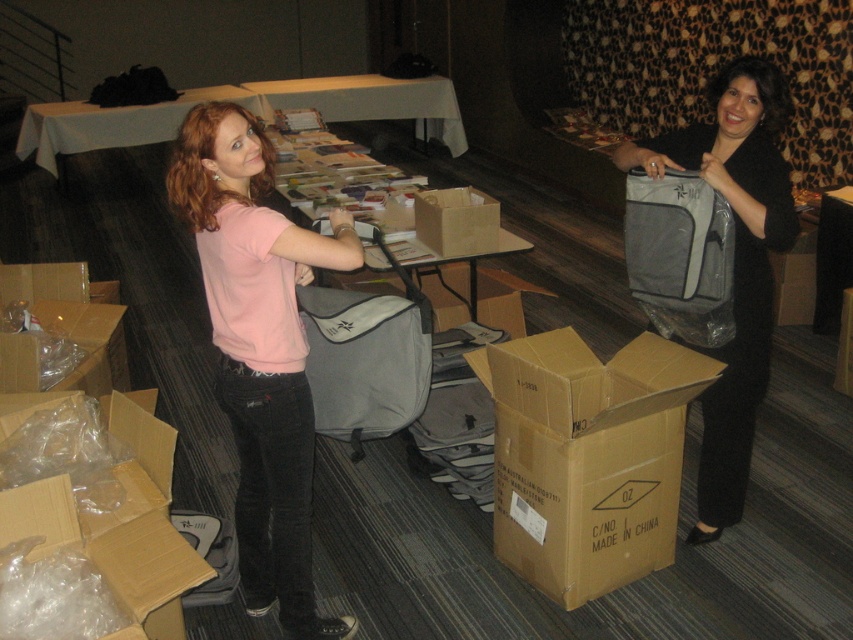
Question: Is the position of pink cotton shirt at center more distant than that of gray fabric bag at right?

Choices:
 (A) yes
 (B) no

Answer: (B)

Question: Which point is closer to the camera?

Choices:
 (A) matte gray bag at center
 (B) pink cotton shirt at center
 (C) brown cardboard box at lower center
 (D) gray fabric bag at right

Answer: (B)

Question: Which of the following is the farthest from the observer?

Choices:
 (A) gray fabric bag at right
 (B) brown cardboard box at lower center
 (C) gray fabric bag at center

Answer: (A)

Question: Is brown cardboard box at lower center bigger than matte gray bag at center?

Choices:
 (A) no
 (B) yes

Answer: (A)

Question: Which point is farther from the camera taking this photo?

Choices:
 (A) (235, 198)
 (B) (527, 534)
 (C) (393, 403)

Answer: (B)

Question: Can you confirm if white paper table at upper center is wider than brown cardboard box at center?

Choices:
 (A) yes
 (B) no

Answer: (A)